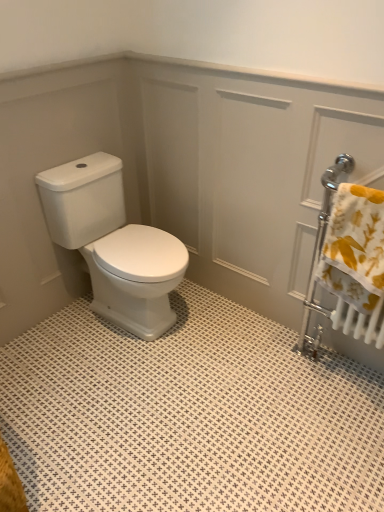
Question: Is white glossy toilet at center shorter than yellow floral fabric at right?

Choices:
 (A) yes
 (B) no

Answer: (B)

Question: Is the position of white glossy toilet at center less distant than that of yellow floral fabric at right?

Choices:
 (A) yes
 (B) no

Answer: (B)

Question: Is white glossy toilet at center not near yellow floral fabric at right?

Choices:
 (A) no
 (B) yes

Answer: (A)

Question: From the image's perspective, is white glossy toilet at center below yellow floral fabric at right?

Choices:
 (A) no
 (B) yes

Answer: (A)

Question: From a real-world perspective, is white glossy toilet at center physically above yellow floral fabric at right?

Choices:
 (A) yes
 (B) no

Answer: (B)

Question: Does white glossy toilet at center appear on the right side of yellow floral fabric at right?

Choices:
 (A) yes
 (B) no

Answer: (B)

Question: Can yellow floral fabric at right be found inside white glossy screen door at center?

Choices:
 (A) no
 (B) yes

Answer: (A)

Question: Does white glossy screen door at center lie behind yellow floral fabric at right?

Choices:
 (A) yes
 (B) no

Answer: (A)

Question: Does white glossy screen door at center have a lesser width compared to yellow floral fabric at right?

Choices:
 (A) yes
 (B) no

Answer: (A)

Question: Is white glossy screen door at center positioned beyond the bounds of yellow floral fabric at right?

Choices:
 (A) yes
 (B) no

Answer: (A)

Question: Considering the relative sizes of white glossy screen door at center and yellow floral fabric at right in the image provided, is white glossy screen door at center taller than yellow floral fabric at right?

Choices:
 (A) no
 (B) yes

Answer: (B)

Question: From a real-world perspective, is white glossy screen door at center over yellow floral fabric at right?

Choices:
 (A) no
 (B) yes

Answer: (A)

Question: Is white glossy toilet at center closer to the viewer compared to white glossy screen door at center?

Choices:
 (A) yes
 (B) no

Answer: (B)